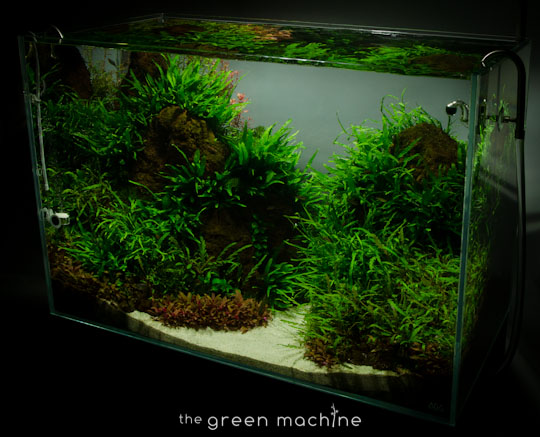
Locate an element on the screen. This screenshot has height=437, width=540. top of fish tank is located at coordinates (301, 32).